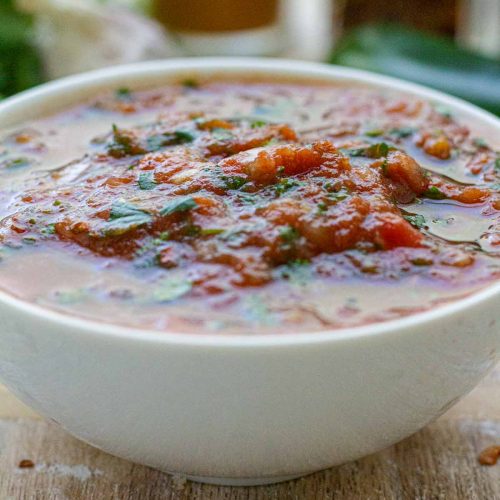
Identify the location of wood table. The image size is (500, 500). (340, 484).